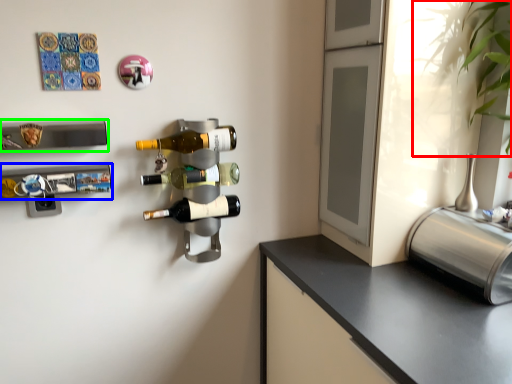
Question: Considering the real-world distances, which object is farthest from plant (highlighted by a red box)? wine rack (highlighted by a blue box) or wine rack (highlighted by a green box)?

Choices:
 (A) wine rack
 (B) wine rack

Answer: (A)